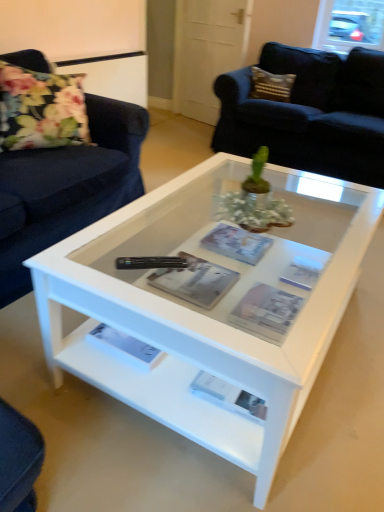
Question: Can you confirm if matte gray magazine at center, which appears as the 3th magazine when viewed from the back, is wider than floral fabric pillow at left?

Choices:
 (A) yes
 (B) no

Answer: (B)

Question: Is the position of matte gray magazine at center, marked as the first magazine in a front-to-back arrangement, less distant than that of floral fabric pillow at left?

Choices:
 (A) no
 (B) yes

Answer: (B)

Question: Is floral fabric pillow at left surrounded by matte gray magazine at center, marked as the first magazine in a front-to-back arrangement?

Choices:
 (A) yes
 (B) no

Answer: (B)

Question: Considering the relative sizes of matte gray magazine at center, marked as the first magazine in a front-to-back arrangement, and floral fabric pillow at left in the image provided, is matte gray magazine at center, marked as the first magazine in a front-to-back arrangement, taller than floral fabric pillow at left?

Choices:
 (A) yes
 (B) no

Answer: (B)

Question: From a real-world perspective, is matte gray magazine at center, which appears as the first magazine when viewed from the back, physically located above or below white glossy coffee table at center?

Choices:
 (A) above
 (B) below

Answer: (A)

Question: In the image, is matte gray magazine at center, which appears as the first magazine when viewed from the back, positioned in front of or behind white glossy coffee table at center?

Choices:
 (A) front
 (B) behind

Answer: (B)

Question: Is matte gray magazine at center, which appears as the third magazine when viewed from the front, situated inside white glossy coffee table at center or outside?

Choices:
 (A) outside
 (B) inside

Answer: (A)

Question: Considering the positions of point (231, 233) and point (168, 303), is point (231, 233) closer or farther from the camera than point (168, 303)?

Choices:
 (A) closer
 (B) farther

Answer: (B)

Question: Considering the positions of matte paper magazine at center, which appears as the 2th magazine when viewed from the back, and matte gray magazine at center, which appears as the third magazine when viewed from the front, in the image, is matte paper magazine at center, which appears as the 2th magazine when viewed from the back, bigger or smaller than matte gray magazine at center, which appears as the third magazine when viewed from the front,?

Choices:
 (A) small
 (B) big

Answer: (A)

Question: Considering the positions of matte paper magazine at center, the 2th magazine viewed from the front, and matte gray magazine at center, which appears as the first magazine when viewed from the back, in the image, is matte paper magazine at center, the 2th magazine viewed from the front, wider or thinner than matte gray magazine at center, which appears as the first magazine when viewed from the back,?

Choices:
 (A) thin
 (B) wide

Answer: (B)

Question: From the image's perspective, is matte paper magazine at center, which appears as the 2th magazine when viewed from the back, located above or below matte gray magazine at center, which appears as the first magazine when viewed from the back?

Choices:
 (A) below
 (B) above

Answer: (A)

Question: Would you say matte paper magazine at center, which appears as the 2th magazine when viewed from the back, is to the left or to the right of matte gray magazine at center, which appears as the third magazine when viewed from the front, in the picture?

Choices:
 (A) left
 (B) right

Answer: (A)

Question: From a real-world perspective, is floral fabric pillow at left above or below black plastic remote at center?

Choices:
 (A) below
 (B) above

Answer: (B)

Question: Is point (29, 79) positioned closer to the camera than point (160, 266)?

Choices:
 (A) farther
 (B) closer

Answer: (A)